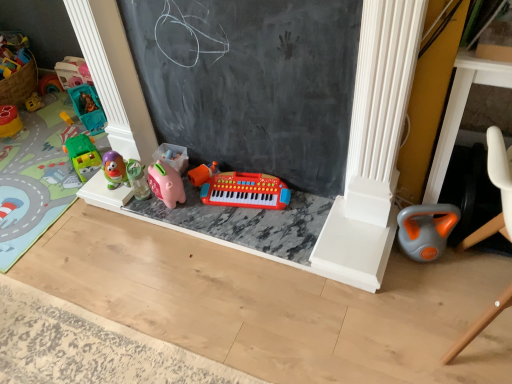
Question: Considering the positions of rubberized green car at left, which ranks as the first toy in left-to-right order, and pink rubber piggy bank at center, which ranks as the fourth toy in left-to-right order, in the image, is rubberized green car at left, which ranks as the first toy in left-to-right order, wider or thinner than pink rubber piggy bank at center, which ranks as the fourth toy in left-to-right order,?

Choices:
 (A) thin
 (B) wide

Answer: (B)

Question: In terms of height, does rubberized green car at left, which ranks as the first toy in left-to-right order, look taller or shorter compared to pink rubber piggy bank at center, arranged as the 4th toy when viewed from the right?

Choices:
 (A) tall
 (B) short

Answer: (B)

Question: Which object is the closest to the pink rubber piggy bank at center, arranged as the 4th toy when viewed from the right?

Choices:
 (A) gray-orange plastic kettlebell at lower right, acting as the 7th toy starting from the left
 (B) teal plastic toy truck at left, which ranks as the second toy in left-to-right order
 (C) green plastic car at left, the 5th toy when ordered from right to left
 (D) black chalkboard at center
 (E) orange plastic toy car at lower right

Answer: (C)

Question: Based on their relative distances, which object is nearer to the pink rubber piggy bank at center, arranged as the 4th toy when viewed from the right?

Choices:
 (A) rubberized green car at left, which is counted as the 7th toy, starting from the right
 (B) black chalkboard at center
 (C) gray-orange plastic kettlebell at lower right, acting as the 7th toy starting from the left
 (D) green plastic car at left, the 5th toy when ordered from right to left
 (E) rubberized plastic keyboard at center, which is the second toy in right-to-left order

Answer: (D)